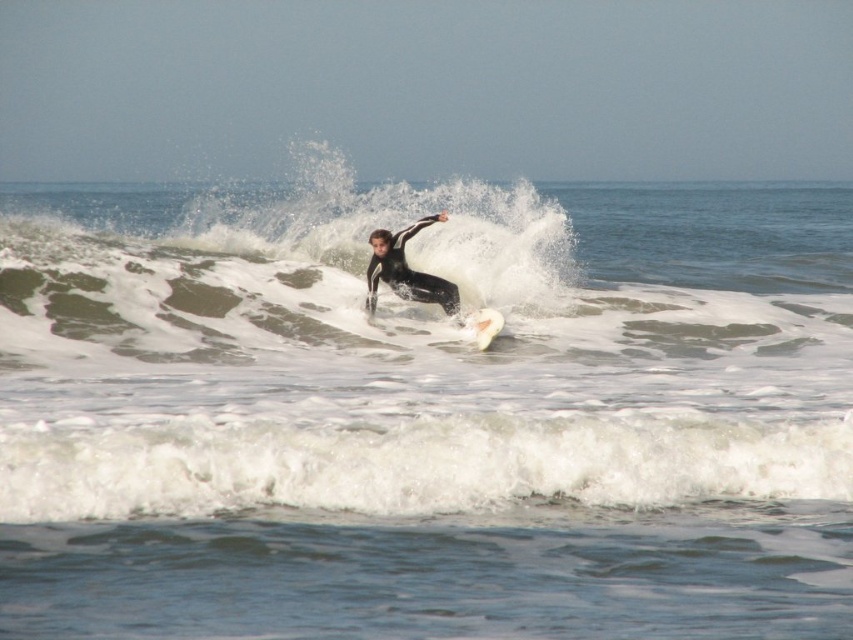
You are a photographer trying to capture the surfer and their board in a single shot. Given that your camera has a depth of field that can focus on objects within a 4 feet range, will both the black matte wetsuit at center and the white foam surfboard at center be in focus?

The black matte wetsuit at center is 3.96 feet away from the white foam surfboard at center. Since the distance between them is within the 4 feet depth of field range, both objects will be in focus.

Consider the image. You are a photographer trying to capture the surfer in action. You notice the black matte wetsuit at center and the white foam surfboard at center. Which object is positioned higher in the image?

The black matte wetsuit at center is above the white foam surfboard at center, so the black matte wetsuit at center is positioned higher in the image.